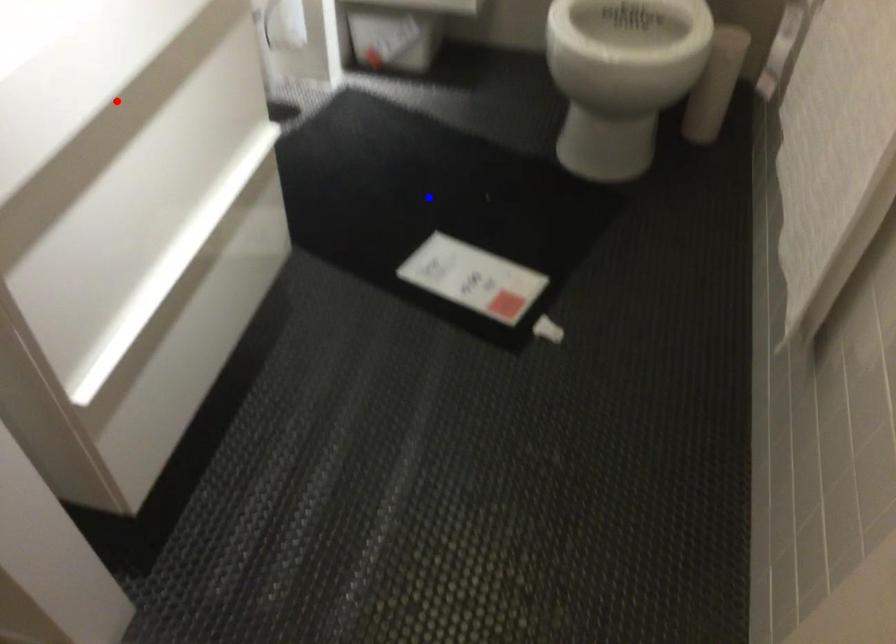
Question: In the image, two points are highlighted. Which point is nearer to the camera? Reply with the corresponding letter.

Choices:
 (A) blue point
 (B) red point

Answer: (B)